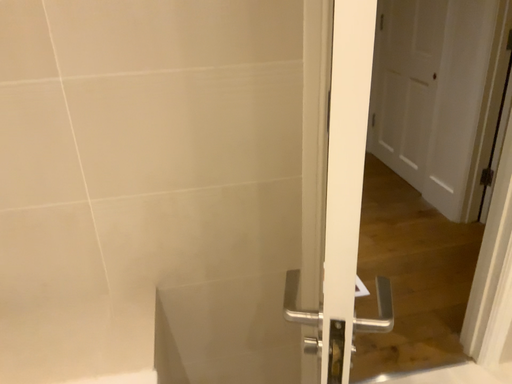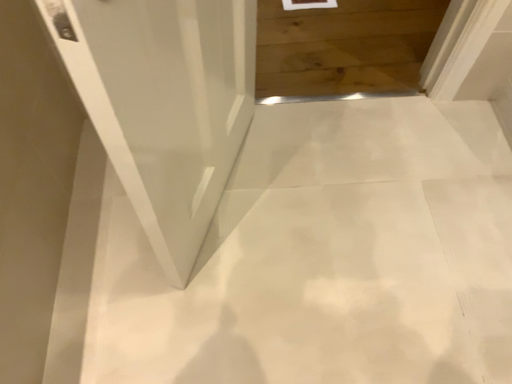
Question: Which way did the camera rotate in the video?

Choices:
 (A) rotated downward
 (B) rotated upward

Answer: (A)